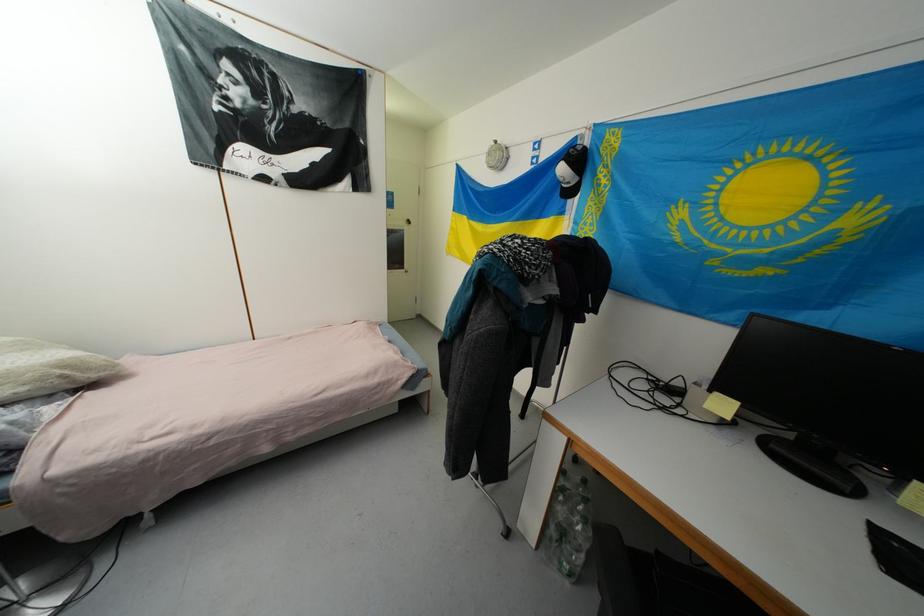
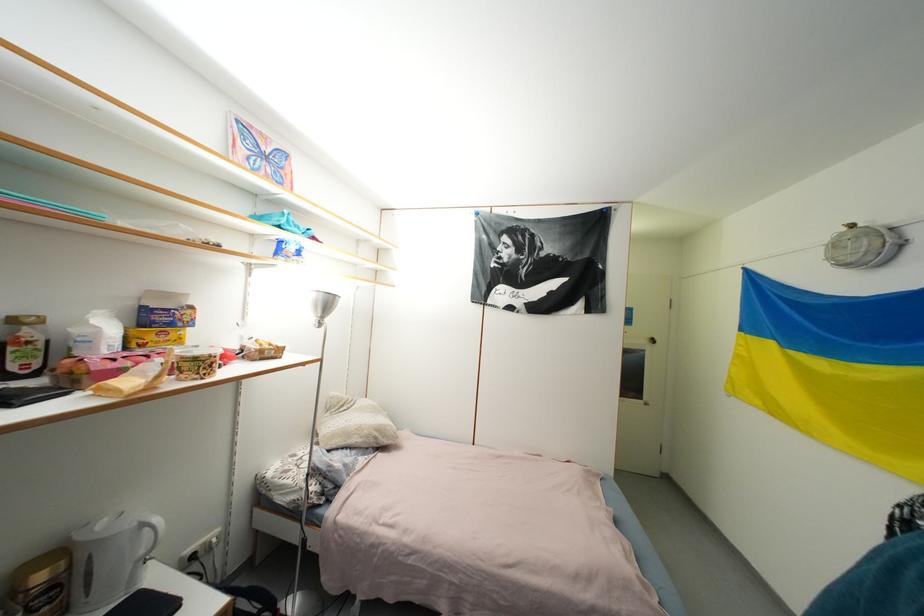
First-person continuous shooting, in which direction is the camera rotating?

The camera rotated toward left-up.